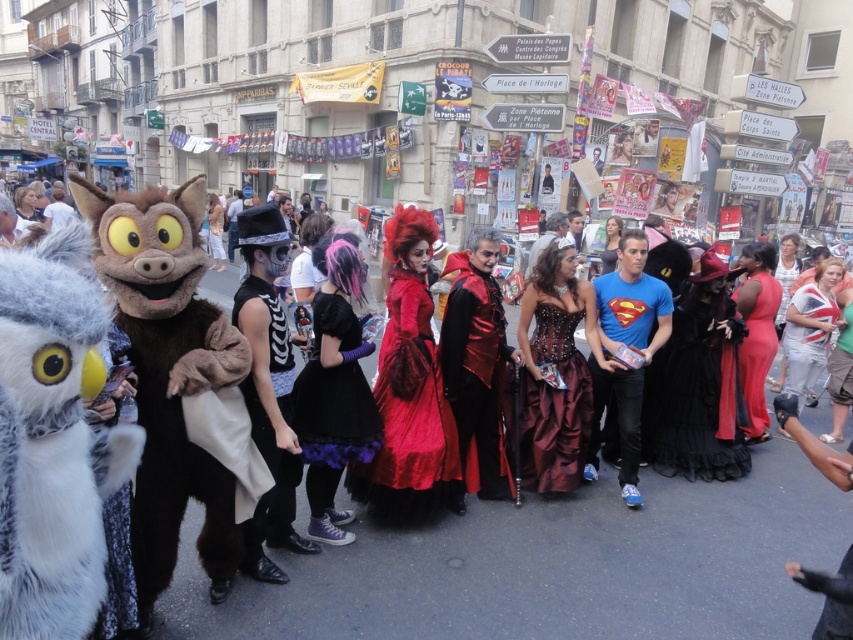
You are standing on the street and want to take a photo of both point [177,593] and point [814,340] in the lively festival scene. Which point is closer to you?

Point [177,593] is closer to the viewer than point [814,340].

You are a photographer trying to capture the shiny red fabric at center and the matte red dress at center in a single shot. Which object will appear larger in your photo?

The shiny red fabric at center will appear larger in the photo because it is closer to the viewer than the matte red dress at center.

You are a photographer at the festival and want to capture both the shiny red fabric at center and the matte red dress at center in a single frame. Given their sizes, which one will occupy more space in your photo?

The shiny red fabric at center has a larger size compared to matte red dress at center, so it will occupy more space in the photo.